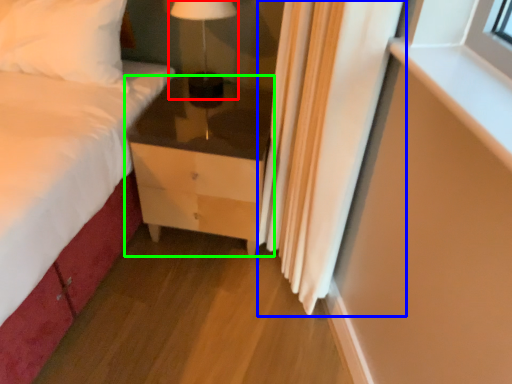
Question: Estimate the real-world distances between objects in this image. Which object is farther from table lamp (highlighted by a red box), curtain (highlighted by a blue box) or chest of drawers (highlighted by a green box)?

Choices:
 (A) curtain
 (B) chest of drawers

Answer: (A)